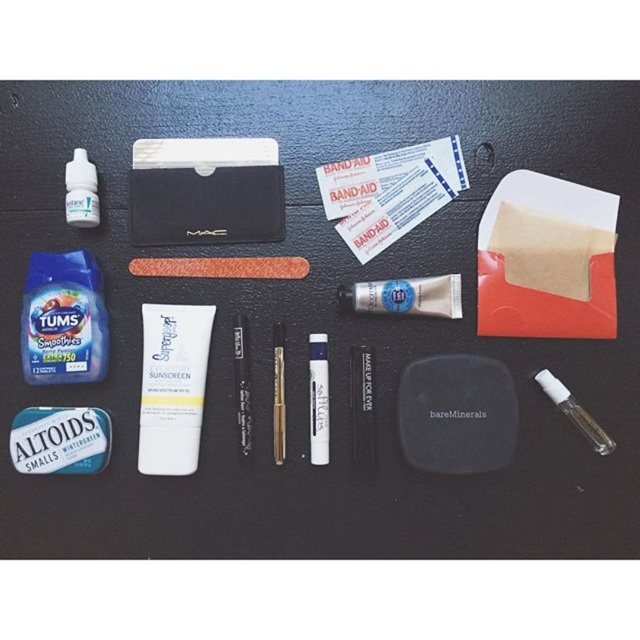
Question: Based on their relative distances, which object is nearer to the white matte tube at center?

Choices:
 (A) clear plastic vial at lower right
 (B) blue metallic altoids at lower left
 (C) clear plastic eye drops at upper left
 (D) yellow matte sunscreen at center

Answer: (A)

Question: Does blue metallic altoids at lower left appear under clear plastic eye drops at upper left?

Choices:
 (A) no
 (B) yes

Answer: (B)

Question: Can you confirm if clear plastic eye drops at upper left is thinner than clear plastic vial at lower right?

Choices:
 (A) yes
 (B) no

Answer: (A)

Question: Which point appears farthest from the camera in this image?

Choices:
 (A) (378, 294)
 (B) (589, 440)

Answer: (A)

Question: Which object is closer to the camera taking this photo?

Choices:
 (A) yellow matte sunscreen at center
 (B) white matte paper at upper center

Answer: (B)

Question: Can you confirm if yellow matte sunscreen at center is positioned below blue plastic tums at left?

Choices:
 (A) yes
 (B) no

Answer: (A)